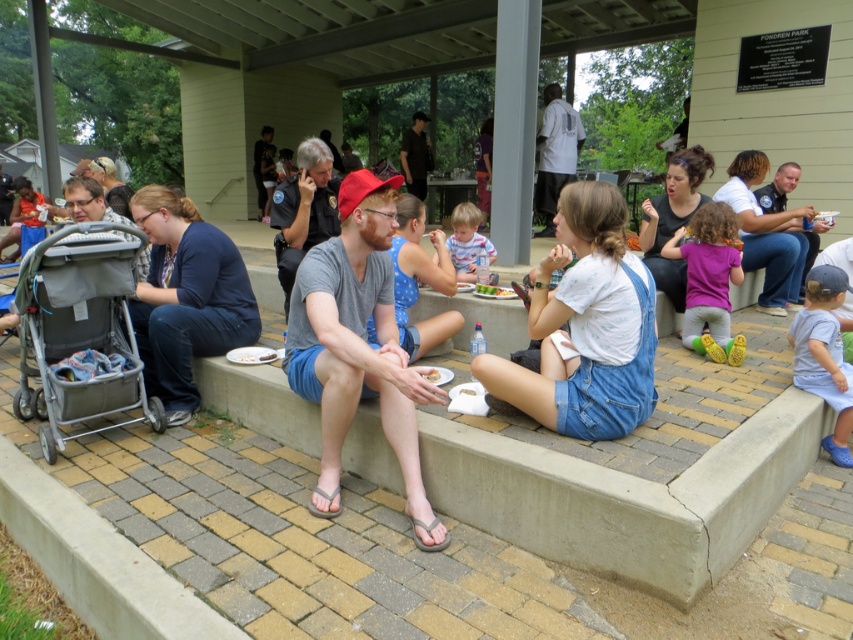
You are a photographer at Fondren Park and want to capture a photo of the blue denim shorts at lower right and light brown hair at center. Based on their positions, which object is located to the right of the other?

The blue denim shorts at lower right is positioned on the right side of light brown hair at center, so the blue denim shorts at lower right is to the right of the light brown hair at center.

You are a photographer at Fondren Park and want to capture a photo of the purple cotton shirt at center and the blue denim shorts at lower right. Based on their positions, which object should you focus on first to ensure both are in frame?

The purple cotton shirt at center is above the blue denim shorts at lower right, so you should focus on the purple cotton shirt at center first to ensure both are in frame.